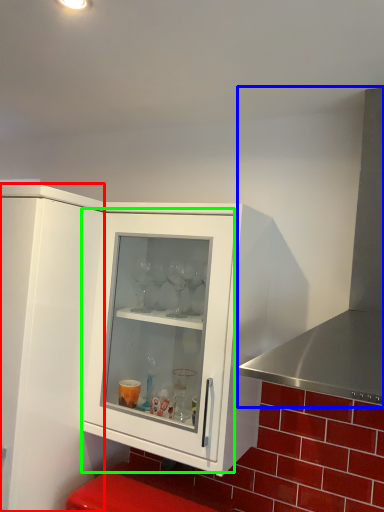
Question: Considering the real-world distances, which object is farthest from cupboard (highlighted by a red box)? exhaust hood (highlighted by a blue box) or glass door (highlighted by a green box)?

Choices:
 (A) exhaust hood
 (B) glass door

Answer: (A)